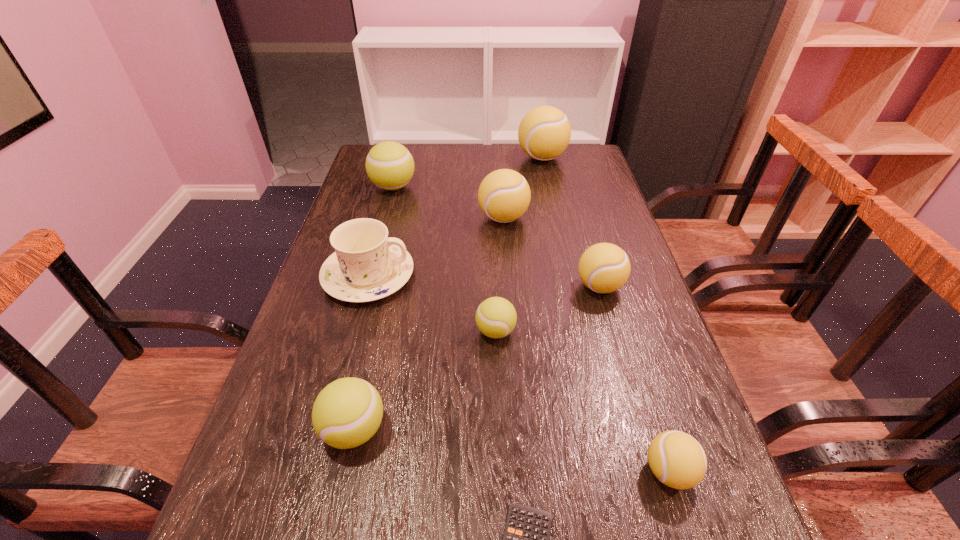
You are a GUI agent. You are given a task and a screenshot of the screen. Output one action in this format:
    pyautogui.click(x=<x>, y=<y>)
    Task: Click on the biggest yellow tennis ball
    
    Given the screenshot: What is the action you would take?
    pyautogui.click(x=544, y=133)

This screenshot has height=540, width=960. In order to click on the farthest tennis ball in this screenshot , I will do `click(544, 133)`.

Locate an element on the screen. This screenshot has width=960, height=540. the fifth nearest tennis ball is located at coordinates (504, 195).

Where is `the seventh nearest object`? The height and width of the screenshot is (540, 960). the seventh nearest object is located at coordinates (504, 195).

You are a GUI agent. You are given a task and a screenshot of the screen. Output one action in this format:
    pyautogui.click(x=<x>, y=<y>)
    Task: Click on the second farthest tennis ball
    Image resolution: width=960 pixels, height=540 pixels.
    Given the screenshot: What is the action you would take?
    pyautogui.click(x=389, y=165)

At what (x,y) coordinates should I click in order to perform the action: click on the farthest green tennis ball. Please return your answer as a coordinate pair (x, y). Looking at the image, I should click on (389, 165).

At what (x,y) coordinates should I click in order to perform the action: click on chinaware. Please return your answer as a coordinate pair (x, y). This screenshot has width=960, height=540. Looking at the image, I should click on (367, 265).

This screenshot has height=540, width=960. In order to click on the second nearest yellow tennis ball in this screenshot , I will do tap(604, 267).

Locate an element on the screen. the fourth nearest tennis ball is located at coordinates (604, 267).

This screenshot has width=960, height=540. I want to click on the second smallest green tennis ball, so click(347, 412).